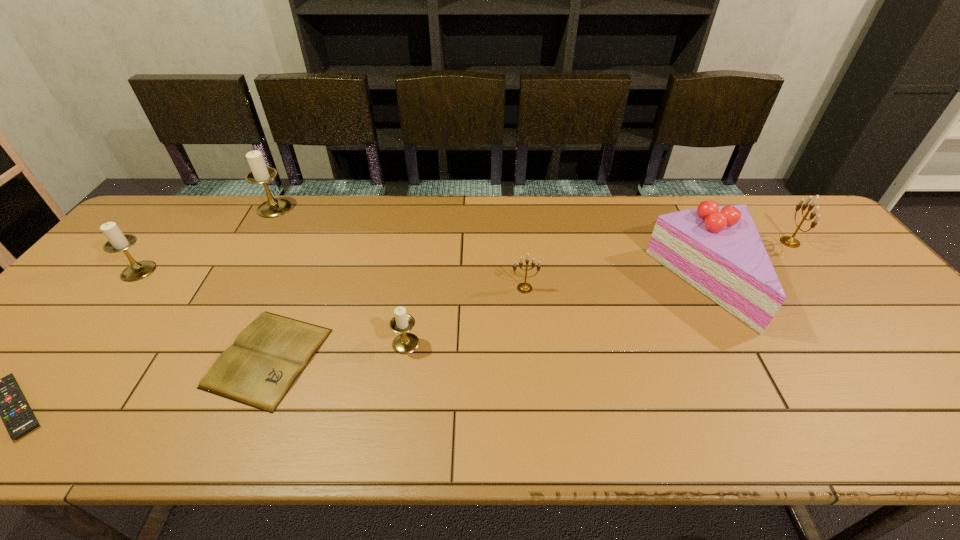
The width and height of the screenshot is (960, 540). I want to click on blank space at the near left corner of the desktop, so click(24, 441).

Locate an element on the screen. The height and width of the screenshot is (540, 960). vacant space that's between the nearest white candle holder and the second white candle holder from right to left is located at coordinates click(340, 276).

Where is `vacant region between the left gold candelabrum and the tallest candle holder`? The width and height of the screenshot is (960, 540). vacant region between the left gold candelabrum and the tallest candle holder is located at coordinates (399, 248).

The width and height of the screenshot is (960, 540). Identify the location of empty space that is in between the rightmost white candle holder and the second farthest white candle holder. (273, 307).

Locate an element on the screen. free space between the nearest white candle holder and the tallest candle holder is located at coordinates (340, 276).

What are the coordinates of `unoccupied position between the second candle holder from left to right and the fourth object from left to right` in the screenshot? It's located at (272, 283).

Where is `free spot between the nearer gold candelabrum and the sixth object from right to left`? The width and height of the screenshot is (960, 540). free spot between the nearer gold candelabrum and the sixth object from right to left is located at coordinates tap(399, 248).

Image resolution: width=960 pixels, height=540 pixels. Identify the location of empty space between the third object from right to left and the purple cake. (615, 286).

Find the location of a particular element. Image resolution: width=960 pixels, height=540 pixels. empty space that is in between the tallest candle holder and the smaller gold candelabrum is located at coordinates (399, 248).

At what (x,y) coordinates should I click in order to perform the action: click on object that is the sixth closest to the fifth object from right to left. Please return your answer as a coordinate pair (x, y). This screenshot has height=540, width=960. Looking at the image, I should click on (717, 249).